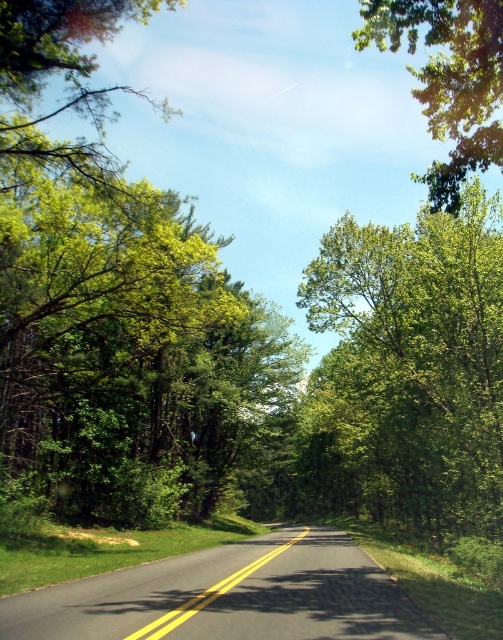
Looking at this image, which is above, green leafy tree at center or green leafy tree at upper right?

green leafy tree at upper right is above.

Can you confirm if green leafy tree at center is positioned below green leafy tree at upper right?

Correct, green leafy tree at center is located below green leafy tree at upper right.

The height and width of the screenshot is (640, 503). I want to click on green leafy tree at center, so click(414, 364).